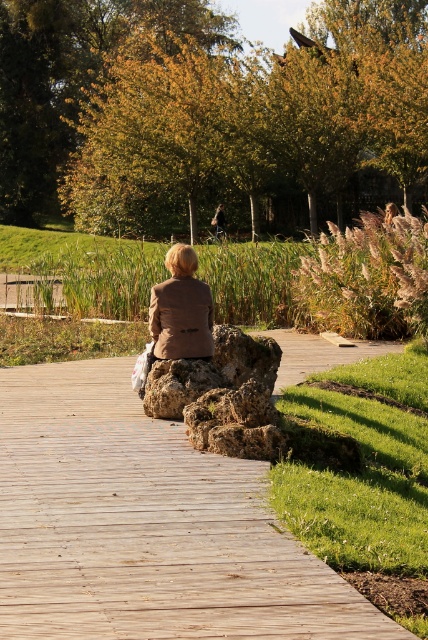
What do you see at coordinates (145, 525) in the screenshot? I see `wooden at center` at bounding box center [145, 525].

Does point (160, 625) come behind point (225, 230)?

That is False.

This screenshot has width=428, height=640. What are the coordinates of `wooden at center` in the screenshot? It's located at (145, 525).

Who is positioned more to the right, wooden at center or brown leather jacket at center?

wooden at center is more to the right.

Does wooden at center have a lesser height compared to brown leather jacket at center?

Correct, wooden at center is not as tall as brown leather jacket at center.

This screenshot has width=428, height=640. I want to click on wooden at center, so click(145, 525).

What do you see at coordinates (181, 308) in the screenshot? The width and height of the screenshot is (428, 640). I see `brown leather jacket at center` at bounding box center [181, 308].

Between brown leather jacket at center and dark brown leather jacket at center, which one appears on the left side from the viewer's perspective?

brown leather jacket at center

Locate an element on the screen. brown leather jacket at center is located at coordinates (181, 308).